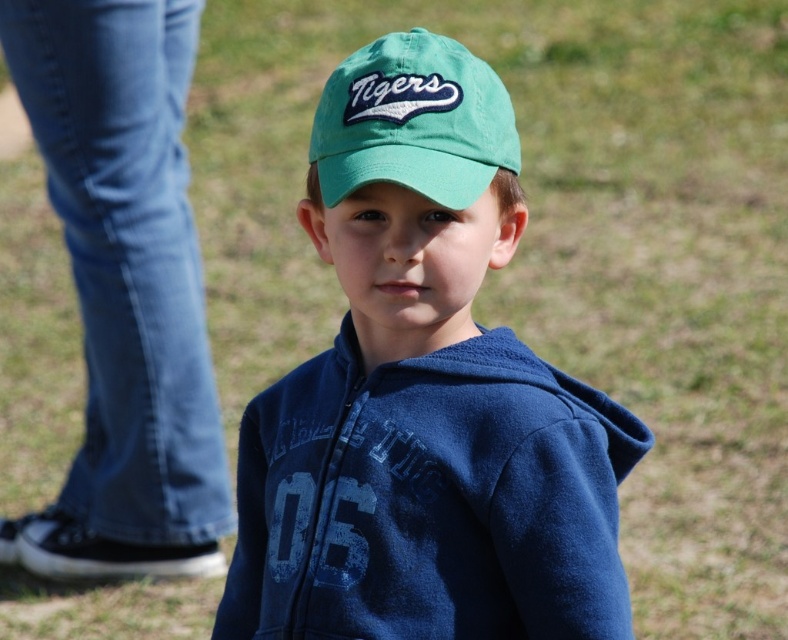
Who is taller, green fabric cap at center or green fabric baseball cap at center?

green fabric cap at center is taller.

Who is more distant from viewer, (x=279, y=634) or (x=320, y=161)?

The point (x=279, y=634) is more distant.

In order to click on green fabric cap at center in this screenshot , I will do `click(424, 396)`.